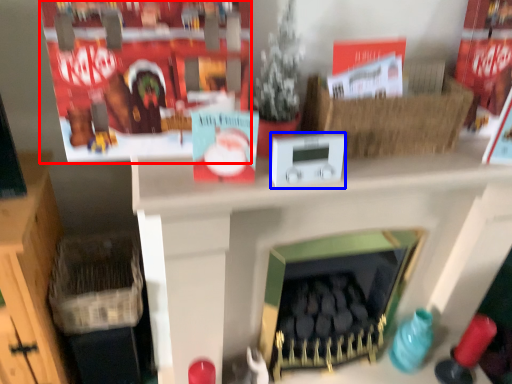
Question: Which of the following is the closest to the observer, shelf (highlighted by a red box) or appliance (highlighted by a blue box)?

Choices:
 (A) shelf
 (B) appliance

Answer: (A)